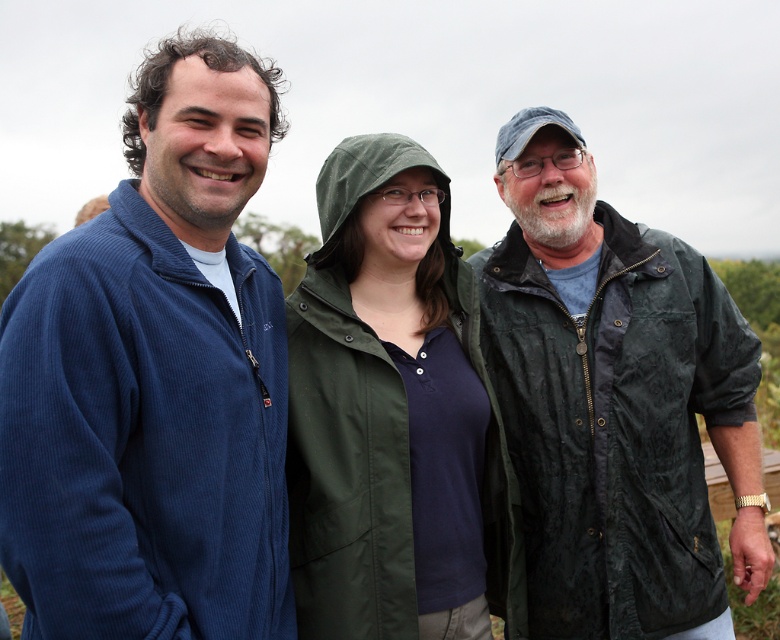
You are a photographer trying to capture a group photo of the three people in the scene. You want to ensure that the person in the corduroy blue jacket at left and the person in the dark green waxed jacket at right are both clearly visible. Given their jacket widths, which jacket might you position closer to the camera to make both appear equally sized in the photo?

The corduroy blue jacket at left has a lesser width compared to the dark green waxed jacket at right. To make them appear equally sized in the photo, you should position the corduroy blue jacket at left closer to the camera since its actual width is smaller. This adjustment would balance their apparent sizes in the photograph.

You are taking a photo of the three people in the scene. The camera is focused on the person in the center. Which direction should you move the camera to include the corduroy blue jacket at left in the frame?

Since the corduroy blue jacket at left is located at point [154,380], you should move the camera to the left to include it in the frame.

You are a photographer standing 2 meters away from the group. You want to take a photo that includes both the corduroy blue jacket at left and the green fabric jacket at center without any of them being cut off. Given that your camera has a maximum field of view of 50 centimeters, will you be able to capture both jackets in the same frame?

The distance between the corduroy blue jacket at left and the green fabric jacket at center is 51.96 centimeters. Since the camera can only capture up to 50 centimeters in its field of view, you will not be able to include both jackets in the same frame without one being cut off.